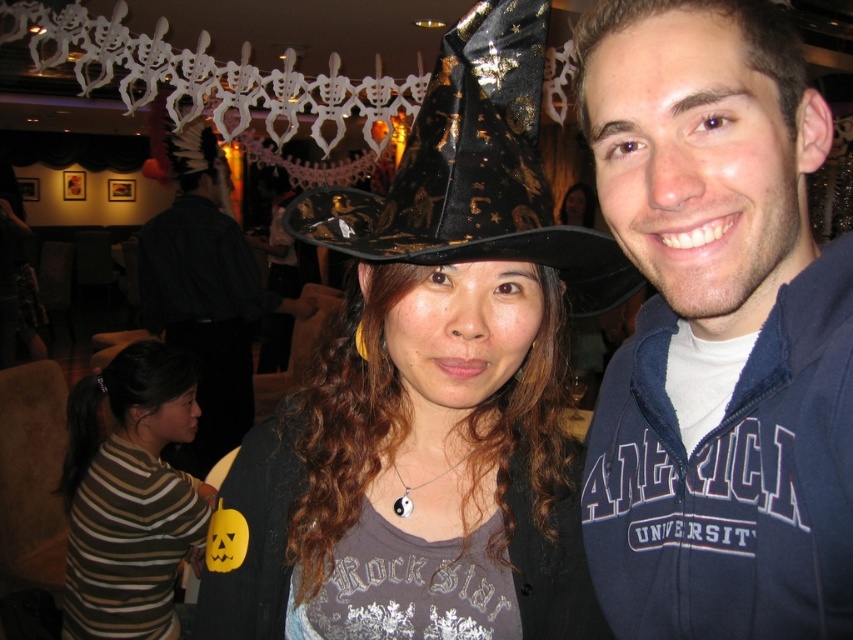
You are a photographer at the Halloween party and want to take a group photo of the blue fleece jacket at right and the black shiny fabric cowboy hat at center. The camera you are using has a minimum focus distance of 5 inches. Can you capture both objects clearly in the same photo without moving either object?

The blue fleece jacket at right is 5.32 inches from the black shiny fabric cowboy hat at center. Since the camera requires a minimum focus distance of 5 inches, the distance between them is sufficient, so yes, you can capture both objects clearly in the same photo without moving them.

In the Halloween party scene, there are two costumes with distinct accessories. The blue fleece jacket at right is worn by someone, and the black shiny fabric cowboy hat at center is part of another outfit. Based on their sizes, which accessory would be more noticeable from a distance?

The blue fleece jacket at right is larger in size compared to the black shiny fabric cowboy hat at center, so it would be more noticeable from a distance.

You are at the Halloween party and want to take a photo of the blue fleece jacket at right and the black shiny fabric cowboy hat at center. Which object should you focus on first to ensure both are in the frame?

You should focus on the blue fleece jacket at right first since it is closer to the viewer, ensuring both objects remain in the frame by adjusting the camera angle accordingly.